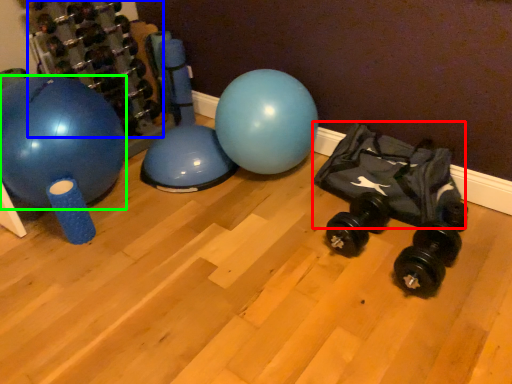
Question: Which is nearer to the bean bag chair (highlighted by a red box)? dumbbell (highlighted by a blue box) or ball (highlighted by a green box).

Choices:
 (A) dumbbell
 (B) ball

Answer: (B)